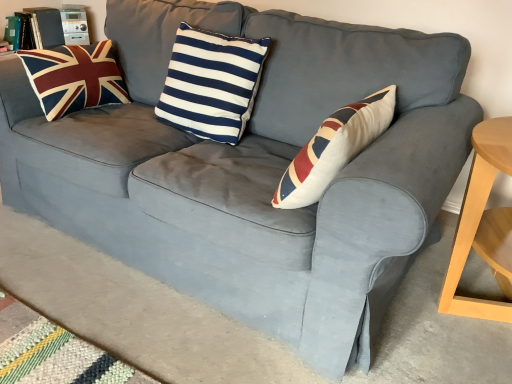
Question: From a real-world perspective, is velvet union jack pillow at left, the first pillow from the left, positioned above or below navy/white striped cushion at center, the first pillow from the right?

Choices:
 (A) above
 (B) below

Answer: (B)

Question: From the image's perspective, relative to navy/white striped cushion at center, the first pillow from the right, is velvet union jack pillow at left, which is the second pillow in right-to-left order, above or below?

Choices:
 (A) below
 (B) above

Answer: (B)

Question: In terms of height, does velvet union jack pillow at left, which is the second pillow in right-to-left order, look taller or shorter compared to navy/white striped cushion at center, the first pillow from the right?

Choices:
 (A) short
 (B) tall

Answer: (A)

Question: Considering the positions of navy/white striped cushion at center, positioned as the 2th pillow in left-to-right order, and velvet union jack pillow at left, the first pillow from the left, in the image, is navy/white striped cushion at center, positioned as the 2th pillow in left-to-right order, taller or shorter than velvet union jack pillow at left, the first pillow from the left,?

Choices:
 (A) short
 (B) tall

Answer: (B)

Question: Relative to velvet union jack pillow at left, which is the second pillow in right-to-left order, is navy/white striped cushion at center, positioned as the 2th pillow in left-to-right order, in front or behind?

Choices:
 (A) front
 (B) behind

Answer: (A)

Question: Considering the relative positions of navy/white striped cushion at center, positioned as the 2th pillow in left-to-right order, and velvet union jack pillow at left, the first pillow from the left, in the image provided, is navy/white striped cushion at center, positioned as the 2th pillow in left-to-right order, to the left or to the right of velvet union jack pillow at left, the first pillow from the left,?

Choices:
 (A) right
 (B) left

Answer: (A)

Question: Is navy/white striped cushion at center, positioned as the 2th pillow in left-to-right order, bigger or smaller than velvet union jack pillow at left, which is the second pillow in right-to-left order?

Choices:
 (A) small
 (B) big

Answer: (B)